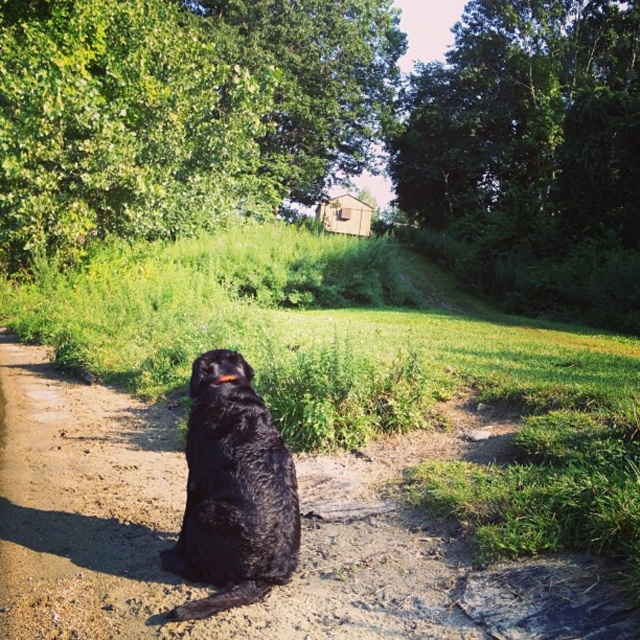
Does dirt track at center appear under shiny black fur at center?

Correct, dirt track at center is located below shiny black fur at center.

Can you confirm if dirt track at center is taller than shiny black fur at center?

No.

Between point (42, 499) and point (252, 481), which one is positioned in front?

Point (252, 481) is in front.

I want to click on dirt track at center, so click(301, 536).